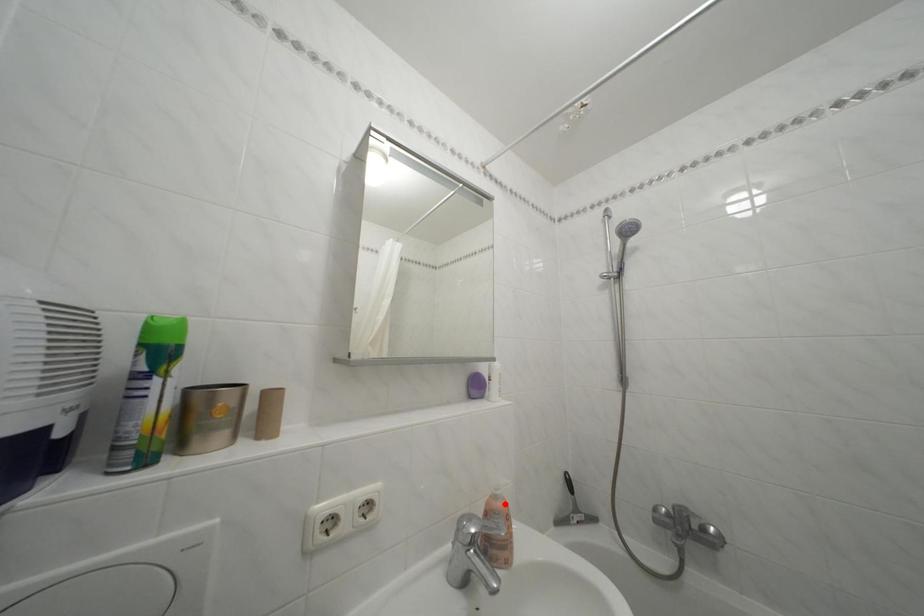
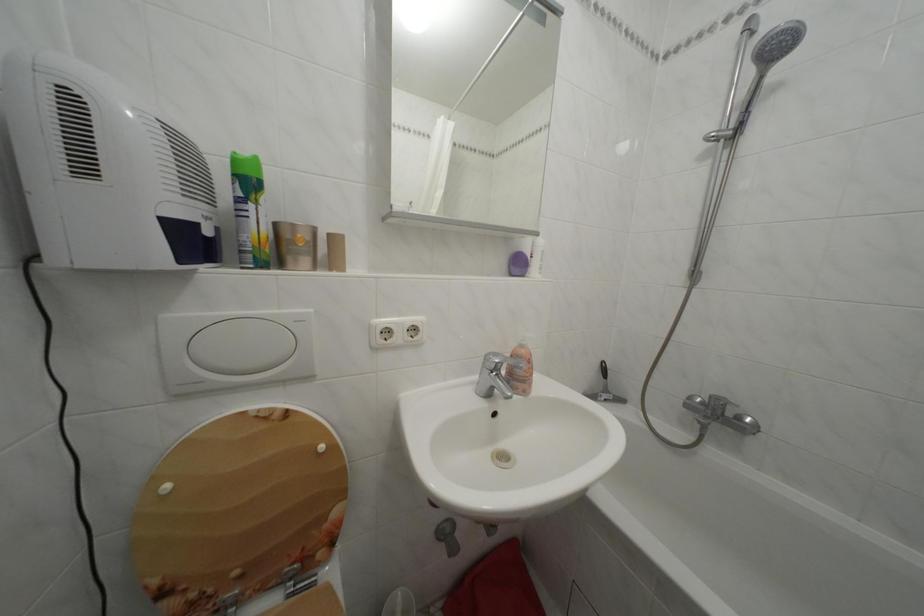
Find the pixel in the second image that matches the highlighted location in the first image.

(530, 352)